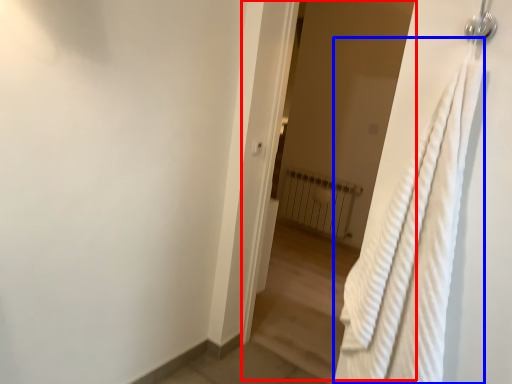
Question: Which of the following is the closest to the observer, screen door (highlighted by a red box) or bath towel (highlighted by a blue box)?

Choices:
 (A) screen door
 (B) bath towel

Answer: (B)